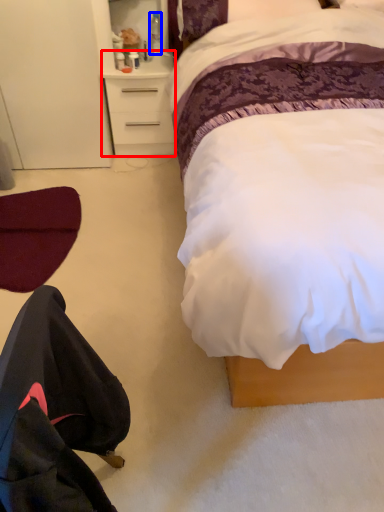
Question: Which of the following is the closest to the observer, desk (highlighted by a red box) or bottle (highlighted by a blue box)?

Choices:
 (A) desk
 (B) bottle

Answer: (A)